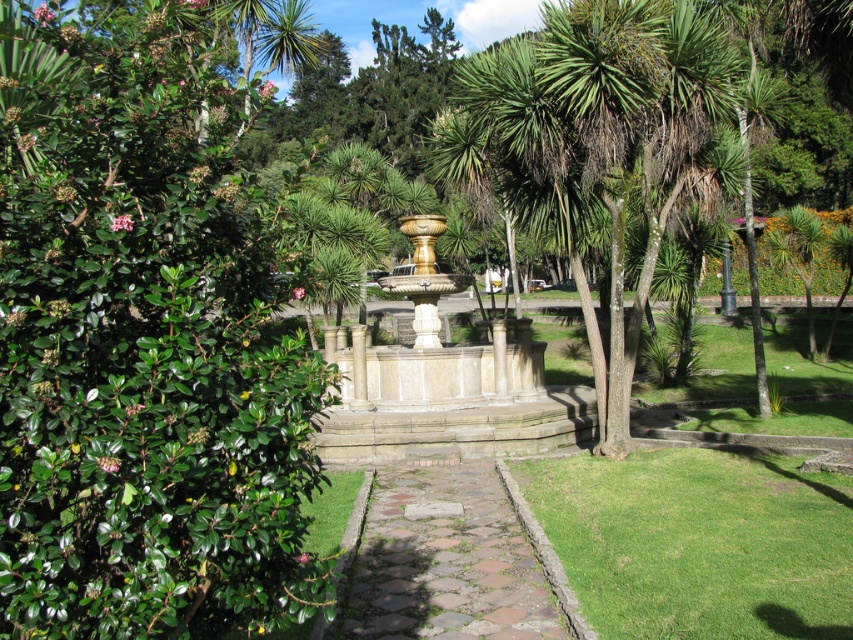
Question: Which object is closer to the camera taking this photo?

Choices:
 (A) green leafy bush at left
 (B) green leafy palm tree at center
 (C) green leafy palm tree at center-right

Answer: (A)

Question: Is green leafy palm tree at center to the left of green leafy palm tree at center-right from the viewer's perspective?

Choices:
 (A) yes
 (B) no

Answer: (A)

Question: Which object is closer to the camera taking this photo?

Choices:
 (A) brown stone path at center
 (B) gold polished stone fountain at center

Answer: (A)

Question: Is green leafy bush at left further to the viewer compared to brown stone path at center?

Choices:
 (A) no
 (B) yes

Answer: (A)

Question: Is the position of green leafy bush at left more distant than that of gold polished stone fountain at center?

Choices:
 (A) yes
 (B) no

Answer: (B)

Question: Which object is the closest to the green leafy bush at left?

Choices:
 (A) green leafy palm tree at center-right
 (B) green leafy palm tree at center
 (C) brown stone path at center

Answer: (C)